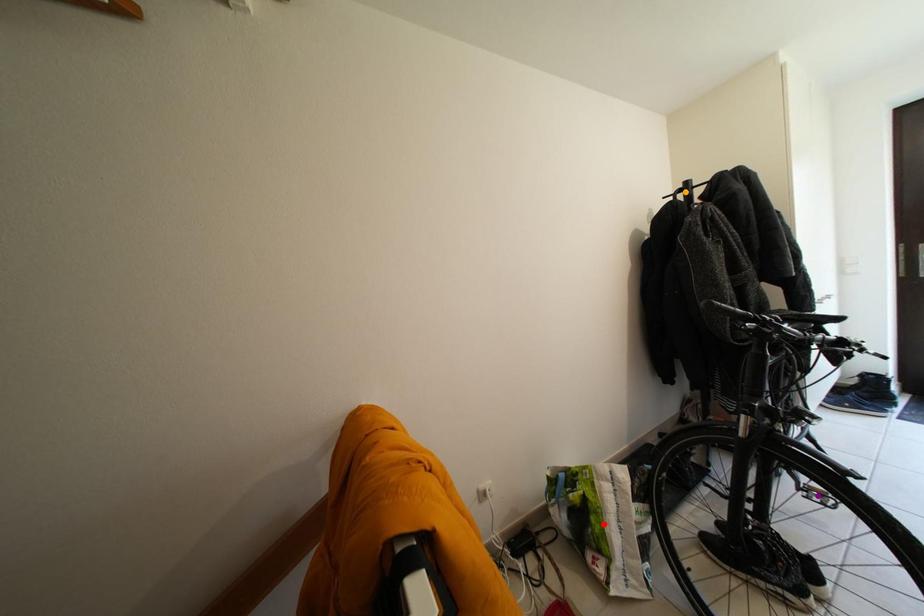
Order these from nearest to farthest:
red point | purple point | orange point

purple point → red point → orange point